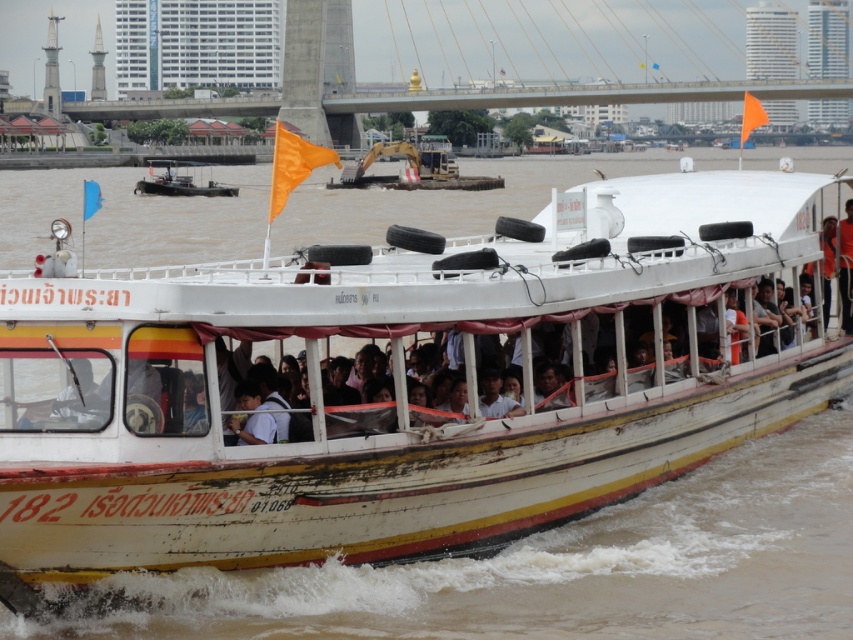
Does metallic gray boat at center have a greater height compared to orange fabric person at center?

Correct, metallic gray boat at center is much taller as orange fabric person at center.

Is point (193, 182) positioned in front of point (848, 330)?

No.

Is point (178, 188) farther from camera compared to point (846, 253)?

Yes, it is.

The image size is (853, 640). What are the coordinates of `metallic gray boat at center` in the screenshot? It's located at (178, 180).

Can you confirm if white wooden boat at center is positioned below orange fabric person at center?

Actually, white wooden boat at center is above orange fabric person at center.

Can you confirm if white wooden boat at center is shorter than orange fabric person at center?

No, white wooden boat at center is not shorter than orange fabric person at center.

Is point (819, 460) positioned behind point (844, 218)?

No, it is not.

What are the coordinates of `white wooden boat at center` in the screenshot? It's located at (592, 556).

Between point (231, 586) and point (216, 192), which one is positioned in front?

Point (231, 586)

Who is higher up, white wooden boat at center or metallic gray boat at center?

metallic gray boat at center is higher up.

Does point (746, 444) come behind point (178, 164)?

No, it is in front of (178, 164).

The height and width of the screenshot is (640, 853). Find the location of `white wooden boat at center`. white wooden boat at center is located at coordinates (592, 556).